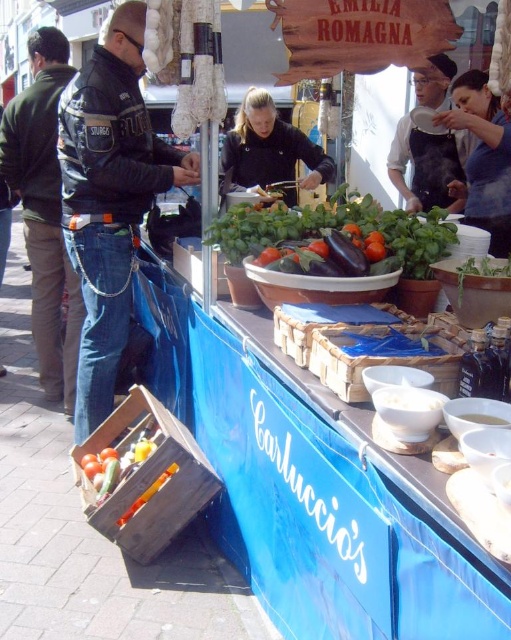
Question: Which object is positioned farthest from the green matte jacket at left?

Choices:
 (A) shiny purple eggplant at center
 (B) blue fabric at upper right
 (C) bright orange carrot at lower left

Answer: (B)

Question: Based on their relative distances, which object is nearer to the black apron at upper right?

Choices:
 (A) bright orange carrot at lower left
 (B) black matte jacket at center
 (C) black leather jacket at left

Answer: (B)

Question: Which of the following is the farthest from the observer?

Choices:
 (A) blue fabric at upper right
 (B) green matte jacket at left

Answer: (B)

Question: Is green matte jacket at left wider than bright orange carrot at lower left?

Choices:
 (A) yes
 (B) no

Answer: (A)

Question: Does green matte jacket at left come behind black matte jacket at center?

Choices:
 (A) yes
 (B) no

Answer: (A)

Question: Is green matte eggplant at center smaller than shiny purple eggplant at center?

Choices:
 (A) yes
 (B) no

Answer: (B)